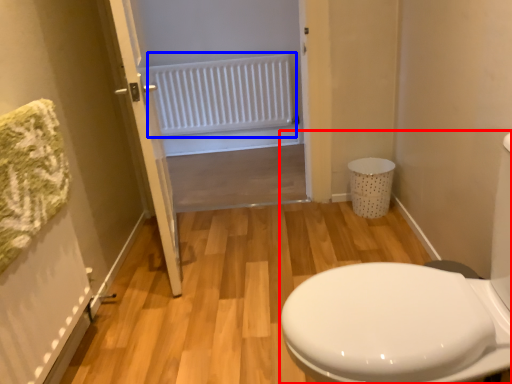
Question: Which object appears closest to the camera in this image, porcelain (highlighted by a red box) or radiator (highlighted by a blue box)?

Choices:
 (A) porcelain
 (B) radiator

Answer: (A)